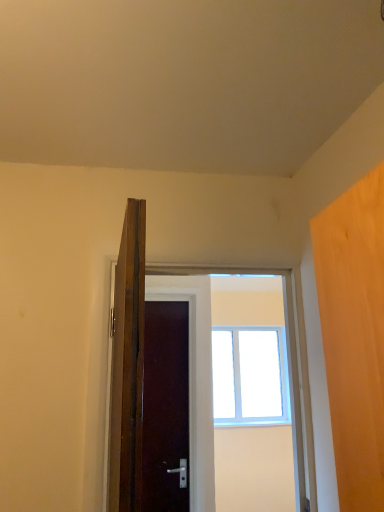
Identify the location of transparent glass window at upper center. point(250,376).

What do you see at coordinates (250, 376) in the screenshot? I see `transparent glass window at upper center` at bounding box center [250, 376].

Locate an element on the screen. transparent glass window at upper center is located at coordinates (250, 376).